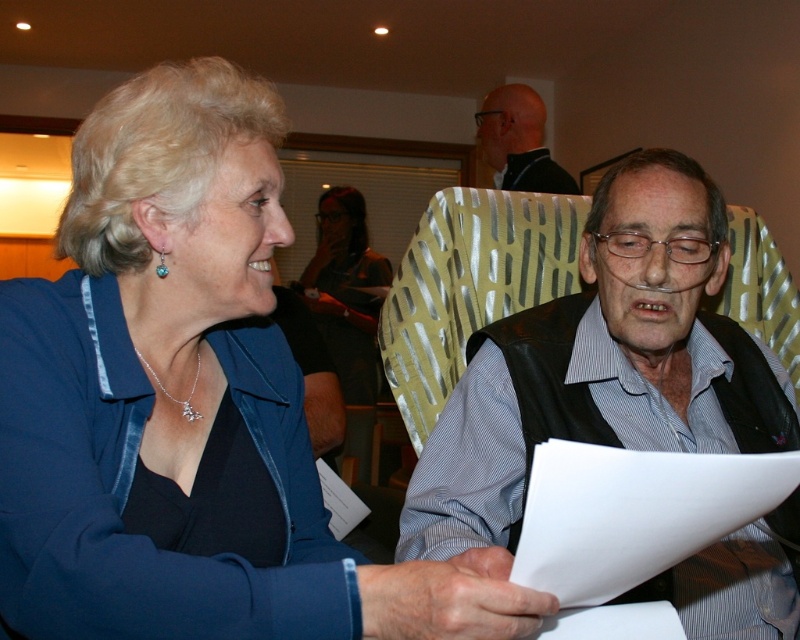
What do you see at coordinates (602, 364) in the screenshot? I see `matte black vest at center` at bounding box center [602, 364].

From the picture: Is matte black vest at center shorter than matte black shirt at upper center?

Incorrect, matte black vest at center's height does not fall short of matte black shirt at upper center's.

Describe the element at coordinates (602, 364) in the screenshot. Image resolution: width=800 pixels, height=640 pixels. I see `matte black vest at center` at that location.

Where is `matte black vest at center`? matte black vest at center is located at coordinates (602, 364).

Can you confirm if matte black jacket at center is smaller than matte black shirt at upper center?

Actually, matte black jacket at center might be larger than matte black shirt at upper center.

Is point (360, 320) closer to camera compared to point (542, 152)?

No, (360, 320) is further to viewer.

You are a GUI agent. You are given a task and a screenshot of the screen. Output one action in this format:
    pyautogui.click(x=<x>, y=<y>)
    Task: Click on the matte black jacket at center
    
    Given the screenshot: What is the action you would take?
    pyautogui.click(x=346, y=291)

Can you confirm if blue fabric at center is positioned above matte black shirt at upper center?

No.

This screenshot has width=800, height=640. Find the location of `blue fabric at center`. blue fabric at center is located at coordinates pos(184,404).